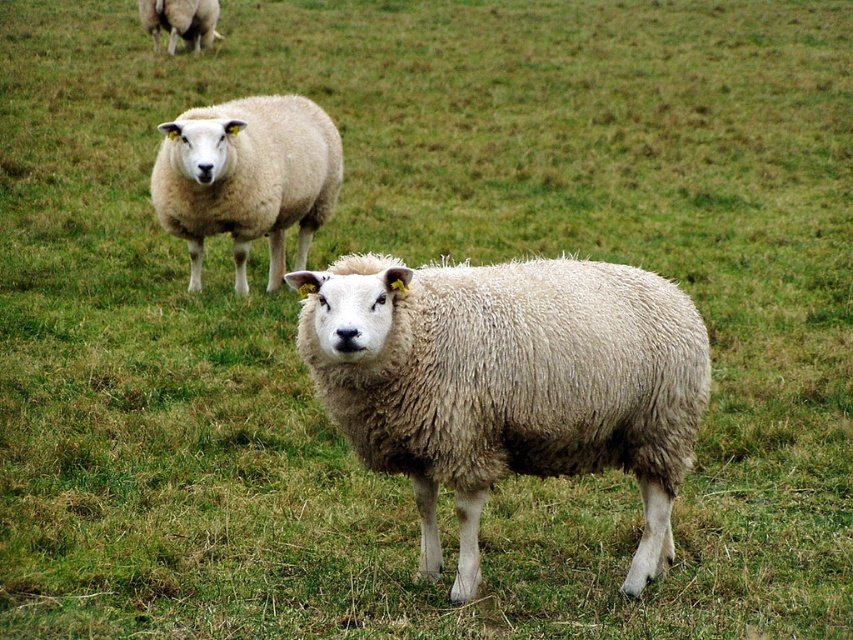
Which is above, fuzzy woolen sheep at center or white woolen sheep at upper left?

Positioned higher is white woolen sheep at upper left.

This screenshot has height=640, width=853. Describe the element at coordinates (508, 381) in the screenshot. I see `fuzzy woolen sheep at center` at that location.

In order to click on fuzzy woolen sheep at center in this screenshot , I will do `click(508, 381)`.

Does fuzzy woolen sheep at center have a greater height compared to fuzzy white sheep at upper left?

Indeed, fuzzy woolen sheep at center has a greater height compared to fuzzy white sheep at upper left.

Is point (599, 368) more distant than point (154, 36)?

No, (599, 368) is in front of (154, 36).

I want to click on fuzzy woolen sheep at center, so click(x=508, y=381).

Consider the image. Who is higher up, white woolen sheep at upper left or fuzzy white sheep at upper left?

fuzzy white sheep at upper left

Does point (337, 170) come closer to viewer compared to point (184, 6)?

Yes, it is.

Find the location of `white woolen sheep at upper left`. white woolen sheep at upper left is located at coordinates (247, 179).